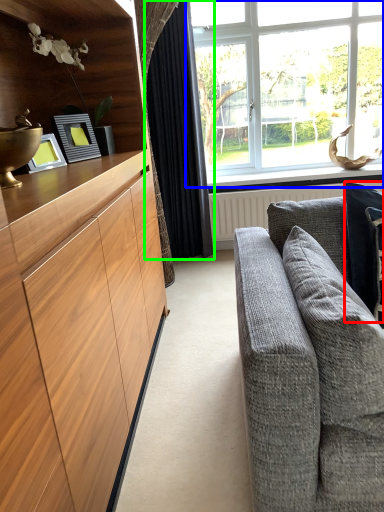
Question: Considering the real-world distances, which object is closest to pillow (highlighted by a red box)? window (highlighted by a blue box) or curtain (highlighted by a green box).

Choices:
 (A) window
 (B) curtain

Answer: (B)